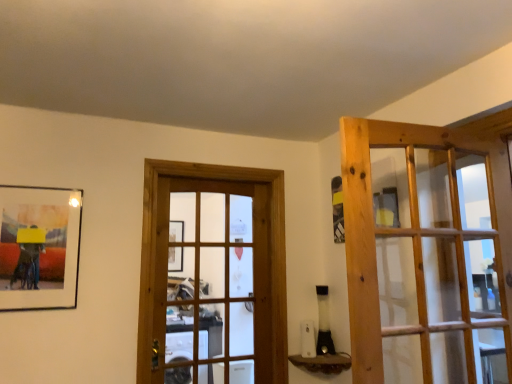
Identify the location of matte black picture frame at left. This screenshot has width=512, height=384. (40, 246).

In order to face brown textured wood at lower center, should I rotate leftwards or rightwards?

You should look right and rotate roughly 8.707 degrees.

You are a GUI agent. You are given a task and a screenshot of the screen. Output one action in this format:
    pyautogui.click(x=<x>, y=<y>)
    Task: Click on the natural wood door at right, acting as the second door starting from the left
    This screenshot has width=512, height=384.
    Given the screenshot: What is the action you would take?
    pyautogui.click(x=422, y=256)

Visually, is wooden door at center, which is the 1th door in left-to-right order, positioned to the left or to the right of brown textured wood at lower center?

Based on their positions, wooden door at center, which is the 1th door in left-to-right order, is located to the left of brown textured wood at lower center.

Looking at this image, would you say wooden door at center, which is the 1th door in left-to-right order, contains brown textured wood at lower center?

No, wooden door at center, which is the 1th door in left-to-right order, does not contain brown textured wood at lower center.

In the image, is wooden door at center, which is the 2th door in front-to-back order, positioned in front of or behind brown textured wood at lower center?

Visually, wooden door at center, which is the 2th door in front-to-back order, is located in front of brown textured wood at lower center.

Is wooden door at center, which is the 1th door in left-to-right order, turned away from brown textured wood at lower center?

No.

Between natural wood door at right, positioned as the first door in front-to-back order, and wooden door at center, which is the 1th door in left-to-right order, which one has larger width?

Wider between the two is wooden door at center, which is the 1th door in left-to-right order.

Is natural wood door at right, positioned as the first door in front-to-back order, shorter than wooden door at center, which is the 2th door in front-to-back order?

Correct, natural wood door at right, positioned as the first door in front-to-back order, is not as tall as wooden door at center, which is the 2th door in front-to-back order.

Are natural wood door at right, positioned as the first door in front-to-back order, and wooden door at center, which is the 1th door in left-to-right order, far apart?

Actually, natural wood door at right, positioned as the first door in front-to-back order, and wooden door at center, which is the 1th door in left-to-right order, are a little close together.

How distant is natural wood door at right, acting as the 2th door starting from the back, from wooden door at center, acting as the first door starting from the back?

39.20 inches.

From the image's perspective, between wooden door at center, which is the 2th door in front-to-back order, and matte black picture frame at left, who is located below?

wooden door at center, which is the 2th door in front-to-back order, from the image's perspective.

From a real-world perspective, is wooden door at center, which is the 2th door in front-to-back order, located higher than matte black picture frame at left?

No, from a real-world perspective, wooden door at center, which is the 2th door in front-to-back order, is not on top of matte black picture frame at left.

Can you confirm if wooden door at center, which is the 1th door in left-to-right order, is thinner than matte black picture frame at left?

No.

Is wooden door at center, which is the 2th door in front-to-back order, next to matte black picture frame at left?

wooden door at center, which is the 2th door in front-to-back order, and matte black picture frame at left are not in contact.

Is the surface of wooden door at center, which is the 1th door in left-to-right order, in direct contact with natural wood door at right, acting as the 2th door starting from the back?

No.

Between wooden door at center, acting as the first door starting from the back, and natural wood door at right, acting as the 2th door starting from the back, which one has more height?

With more height is wooden door at center, acting as the first door starting from the back.

Image resolution: width=512 pixels, height=384 pixels. In order to click on door that is above the wooden door at center, which is counted as the 2th door, starting from the right (from a real-world perspective) in this screenshot , I will do `click(422, 256)`.

Between wooden door at center, which is the 1th door in left-to-right order, and natural wood door at right, the 1th door in the right-to-left sequence, which one has smaller size?

natural wood door at right, the 1th door in the right-to-left sequence, is smaller.

Is natural wood door at right, acting as the 2th door starting from the back, located within matte black picture frame at left?

No, matte black picture frame at left does not contain natural wood door at right, acting as the 2th door starting from the back.

In terms of height, does matte black picture frame at left look taller or shorter compared to natural wood door at right, positioned as the first door in front-to-back order?

In the image, matte black picture frame at left appears to be shorter than natural wood door at right, positioned as the first door in front-to-back order.

Considering the sizes of objects matte black picture frame at left and natural wood door at right, the 1th door in the right-to-left sequence, in the image provided, who is wider, matte black picture frame at left or natural wood door at right, the 1th door in the right-to-left sequence,?

Wider between the two is natural wood door at right, the 1th door in the right-to-left sequence.

Is natural wood door at right, positioned as the first door in front-to-back order, wider than matte black picture frame at left?

Yes.

From a real-world perspective, between natural wood door at right, acting as the second door starting from the left, and matte black picture frame at left, who is vertically lower?

natural wood door at right, acting as the second door starting from the left, is physically lower.

Relative to wooden door at center, which is the 2th door in front-to-back order, is matte black picture frame at left in front or behind?

matte black picture frame at left is positioned closer to the viewer than wooden door at center, which is the 2th door in front-to-back order.

Is matte black picture frame at left at the left side of wooden door at center, which is counted as the 2th door, starting from the right?

Yes, matte black picture frame at left is to the left of wooden door at center, which is counted as the 2th door, starting from the right.

From a real-world perspective, which is physically above, matte black picture frame at left or wooden door at center, which is the 2th door in front-to-back order?

matte black picture frame at left is physically above.

Is matte black picture frame at left not inside wooden door at center, acting as the first door starting from the back?

Indeed, matte black picture frame at left is completely outside wooden door at center, acting as the first door starting from the back.

Find the location of a particular element. The width and height of the screenshot is (512, 384). window sill that appears below the wooden door at center, which is the 1th door in left-to-right order (from the image's perspective) is located at coordinates (323, 362).

Find the location of a particular element. The width and height of the screenshot is (512, 384). door that appears behind the natural wood door at right, the 1th door in the right-to-left sequence is located at coordinates (270, 244).

Estimate the real-world distances between objects in this image. Which object is closer to natural wood door at right, acting as the second door starting from the left, matte black picture frame at left or brown textured wood at lower center?

brown textured wood at lower center is closer to natural wood door at right, acting as the second door starting from the left.

Based on their spatial positions, is matte black picture frame at left or wooden door at center, which is the 1th door in left-to-right order, closer to natural wood door at right, positioned as the first door in front-to-back order?

wooden door at center, which is the 1th door in left-to-right order, is closer to natural wood door at right, positioned as the first door in front-to-back order.

From the image, which object appears to be farther from wooden door at center, which is counted as the 2th door, starting from the right, natural wood door at right, acting as the 2th door starting from the back, or brown textured wood at lower center?

Based on the image, natural wood door at right, acting as the 2th door starting from the back, appears to be further to wooden door at center, which is counted as the 2th door, starting from the right.

Based on their spatial positions, is brown textured wood at lower center or natural wood door at right, the 1th door in the right-to-left sequence, further from wooden door at center, which is counted as the 2th door, starting from the right?

natural wood door at right, the 1th door in the right-to-left sequence.

Looking at the image, which one is located closer to natural wood door at right, the 1th door in the right-to-left sequence, wooden door at center, which is the 2th door in front-to-back order, or matte black picture frame at left?

Based on the image, wooden door at center, which is the 2th door in front-to-back order, appears to be nearer to natural wood door at right, the 1th door in the right-to-left sequence.

Which object lies further to the anchor point natural wood door at right, acting as the second door starting from the left, brown textured wood at lower center or matte black picture frame at left?

matte black picture frame at left.

When comparing their distances from matte black picture frame at left, does brown textured wood at lower center or wooden door at center, which is counted as the 2th door, starting from the right, seem further?

Among the two, brown textured wood at lower center is located further to matte black picture frame at left.

When comparing their distances from brown textured wood at lower center, does wooden door at center, which is the 2th door in front-to-back order, or matte black picture frame at left seem closer?

Based on the image, wooden door at center, which is the 2th door in front-to-back order, appears to be nearer to brown textured wood at lower center.

At what (x,y) coordinates should I click in order to perform the action: click on door between matte black picture frame at left and brown textured wood at lower center from left to right. Please return your answer as a coordinate pair (x, y). The height and width of the screenshot is (384, 512). Looking at the image, I should click on (270, 244).

In order to click on door between matte black picture frame at left and natural wood door at right, acting as the 2th door starting from the back in this screenshot , I will do `click(270, 244)`.

Identify the location of door located between natural wood door at right, positioned as the first door in front-to-back order, and brown textured wood at lower center in the depth direction. The height and width of the screenshot is (384, 512). (270, 244).

The width and height of the screenshot is (512, 384). I want to click on window sill situated between matte black picture frame at left and natural wood door at right, the 1th door in the right-to-left sequence, from left to right, so click(323, 362).